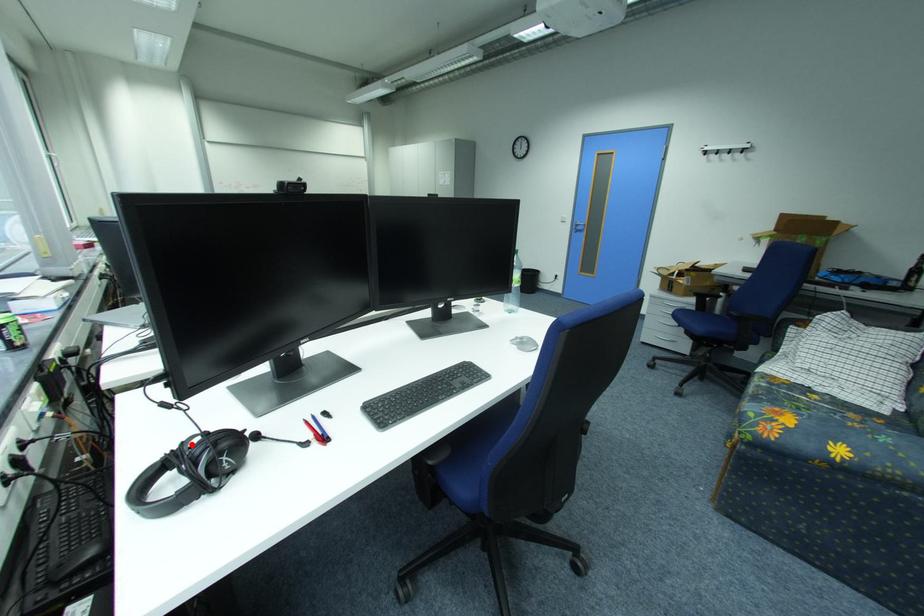
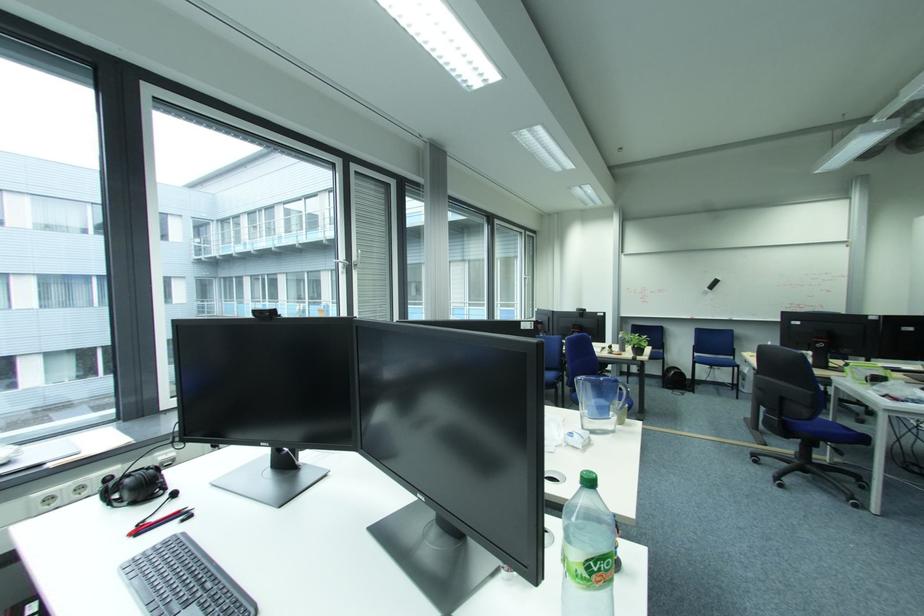
Question: I am providing you with two images of the same scene from different viewpoints. A red point is marked on the first image. At the location where the point appears in image 1, is it still visible in image 2?

Choices:
 (A) Yes
 (B) No

Answer: (B)